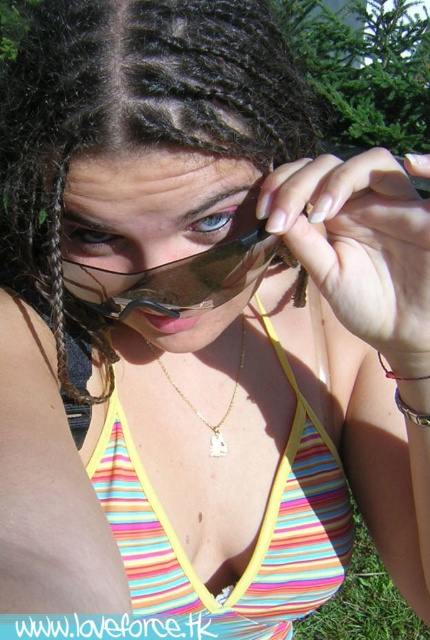
Consider the image. You are a makeup artist observing the blue matte eye at center and the silver metallic bracelet at lower right. Which object appears smaller in height when viewed from your perspective?

The blue matte eye at center has a lesser height compared to the silver metallic bracelet at lower right, so the blue matte eye at center appears smaller in height.

You are a photographer adjusting your camera settings to focus on the subject in the scene. The camera has a fixed focal point at point [211,220]. What part of the person is the camera focusing on?

The camera is focusing on the blue matte eye at center, as point [211,220] corresponds to that location.